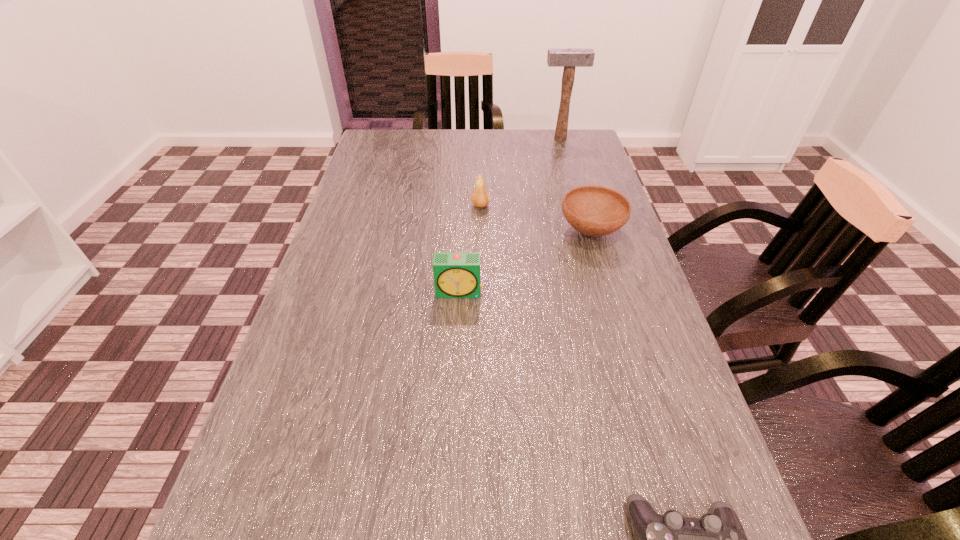
Where is `mallet at the right edge`? mallet at the right edge is located at coordinates coord(569,58).

Image resolution: width=960 pixels, height=540 pixels. What are the coordinates of `bowl located at the right edge` in the screenshot? It's located at (592, 210).

Where is `object that is at the far right corner`? object that is at the far right corner is located at coordinates point(569,58).

Where is `blank space at the far edge of the desktop`? The width and height of the screenshot is (960, 540). blank space at the far edge of the desktop is located at coordinates (454, 152).

At what (x,y) coordinates should I click in order to perform the action: click on free space at the left edge. Please return your answer as a coordinate pair (x, y). This screenshot has height=540, width=960. Looking at the image, I should click on (384, 213).

You are a GUI agent. You are given a task and a screenshot of the screen. Output one action in this format:
    pyautogui.click(x=<x>, y=<y>)
    Task: Click on the free region at the right edge
    The height and width of the screenshot is (540, 960).
    Given the screenshot: What is the action you would take?
    pyautogui.click(x=632, y=378)

Where is `vacant space at the far left corner of the desktop`? vacant space at the far left corner of the desktop is located at coordinates (364, 161).

This screenshot has height=540, width=960. In order to click on vacant space in between the bowl and the alarm clock in this screenshot , I will do click(525, 262).

At what (x,y) coordinates should I click in order to perform the action: click on free point between the alarm clock and the bowl. Please return your answer as a coordinate pair (x, y). Image resolution: width=960 pixels, height=540 pixels. Looking at the image, I should click on (525, 262).

Where is `free space between the pear and the second nearest object`? This screenshot has width=960, height=540. free space between the pear and the second nearest object is located at coordinates (469, 249).